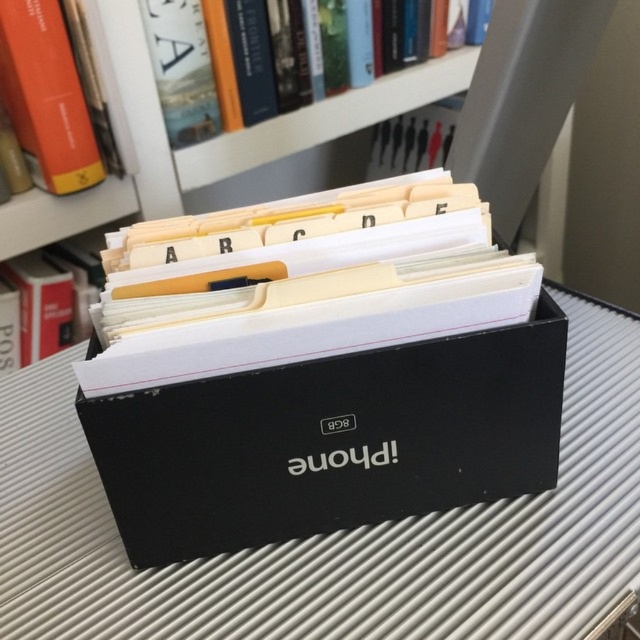
You are a delivery person who needs to place a package on the desk. The package is 1.2 meters long. There is a hardcover book at upper center on the desk. Is there enough space to place the package horizontally without moving the book?

The hardcover book at upper center and camera are 1.32 meters apart. Since the package is 1.2 meters long and the available space between the hardcover book at upper center and the camera is 1.32 meters, there is sufficient space to place the package horizontally without moving the book.

You are organizing items on a desk and need to place both the black matte box at center and the hardcover book at upper center. Given their sizes, which one should you place first to ensure stability?

The black matte box at center is larger than the hardcover book at upper center, so you should place the black matte box at center first to ensure stability.

You are standing in front of a desk with the black rectangular box labeled iPhone 8GB. There is a point at coordinates (337, 532). What object is located at that point?

The point at coordinates (337, 532) corresponds to the black matte box at center.